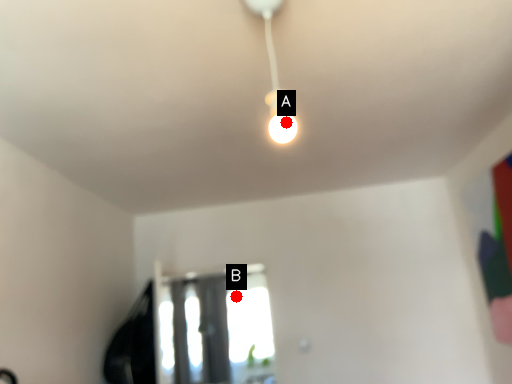
Question: Two points are circled on the image, labeled by A and B beside each circle. Which point is further to the camera?

Choices:
 (A) A is further
 (B) B is further

Answer: (B)